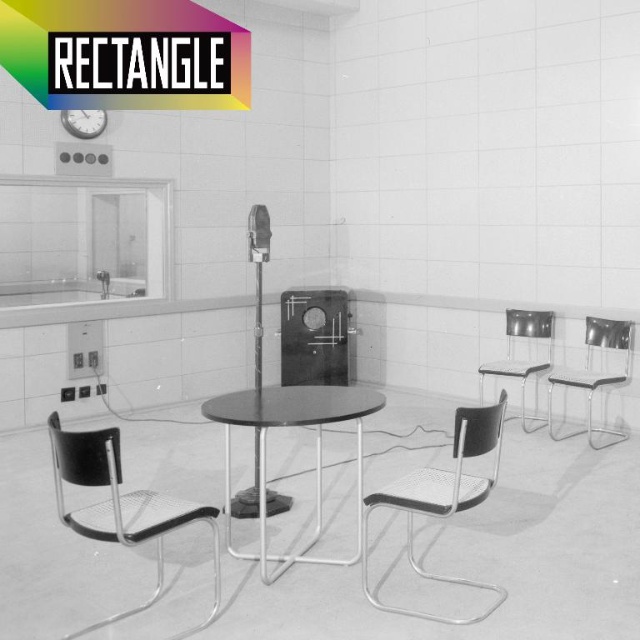
Question: Is black mesh swivel chair at left bigger than metallic mesh swivel chair at center?

Choices:
 (A) no
 (B) yes

Answer: (B)

Question: Which of the following is the closest to the observer?

Choices:
 (A) clear plastic chair at right
 (B) metallic black table at center

Answer: (B)

Question: Does metallic black table at center appear on the left side of clear plastic chair at right?

Choices:
 (A) yes
 (B) no

Answer: (A)

Question: Among these points, which one is nearest to the camera?

Choices:
 (A) (305, 419)
 (B) (99, 484)
 (C) (456, 580)

Answer: (B)

Question: Based on their relative distances, which object is nearer to the clear plastic chair at right?

Choices:
 (A) metallic clock at upper left
 (B) metallic black table at center
 (C) metallic speaker at center
 (D) metal mesh chair at right

Answer: (D)

Question: Where is metallic black table at center located in relation to metallic clock at upper left in the image?

Choices:
 (A) below
 (B) above

Answer: (A)